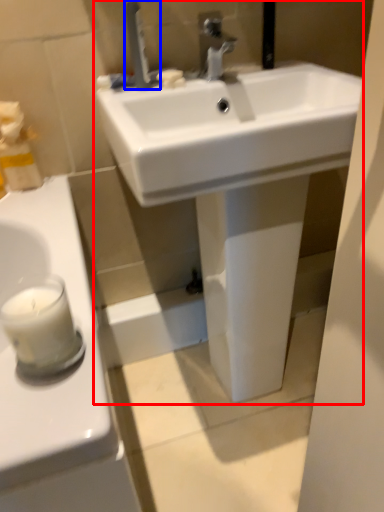
Question: Among these objects, which one is nearest to the camera, sink (highlighted by a red box) or tap (highlighted by a blue box)?

Choices:
 (A) sink
 (B) tap

Answer: (A)